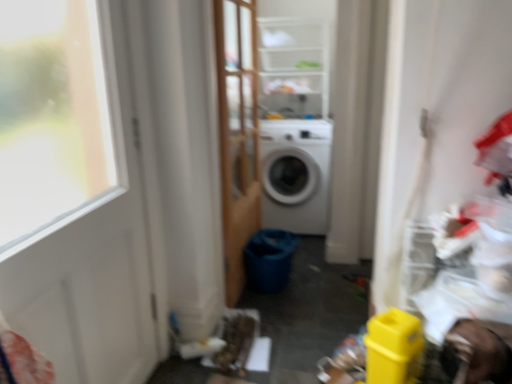
Question: Is clear plastic shelves at upper center a part of white matte door at left?

Choices:
 (A) no
 (B) yes

Answer: (A)

Question: Are white matte door at left and clear plastic shelves at upper center located far from each other?

Choices:
 (A) no
 (B) yes

Answer: (B)

Question: Is white matte door at left in contact with clear plastic shelves at upper center?

Choices:
 (A) yes
 (B) no

Answer: (B)

Question: From a real-world perspective, is white matte door at left physically above clear plastic shelves at upper center?

Choices:
 (A) no
 (B) yes

Answer: (A)

Question: Is white matte door at left completely or partially outside of clear plastic shelves at upper center?

Choices:
 (A) no
 (B) yes

Answer: (B)

Question: Considering the relative sizes of white matte door at left and clear plastic shelves at upper center in the image provided, is white matte door at left smaller than clear plastic shelves at upper center?

Choices:
 (A) yes
 (B) no

Answer: (A)

Question: From a real-world perspective, is white matte door at left physically above white matte washing machine at center?

Choices:
 (A) yes
 (B) no

Answer: (A)

Question: Is white matte washing machine at center at the back of white matte door at left?

Choices:
 (A) no
 (B) yes

Answer: (A)

Question: Is white matte door at left wider than white matte washing machine at center?

Choices:
 (A) yes
 (B) no

Answer: (B)

Question: Considering the relative positions of white matte door at left and white matte washing machine at center in the image provided, is white matte door at left to the left of white matte washing machine at center from the viewer's perspective?

Choices:
 (A) yes
 (B) no

Answer: (A)

Question: Is there a large distance between white matte door at left and white matte washing machine at center?

Choices:
 (A) yes
 (B) no

Answer: (A)

Question: Is white matte washing machine at center a part of white matte door at left?

Choices:
 (A) yes
 (B) no

Answer: (B)

Question: Considering the relative positions of wooden screen door at center and white matte washing machine at center in the image provided, is wooden screen door at center to the right of white matte washing machine at center from the viewer's perspective?

Choices:
 (A) yes
 (B) no

Answer: (B)